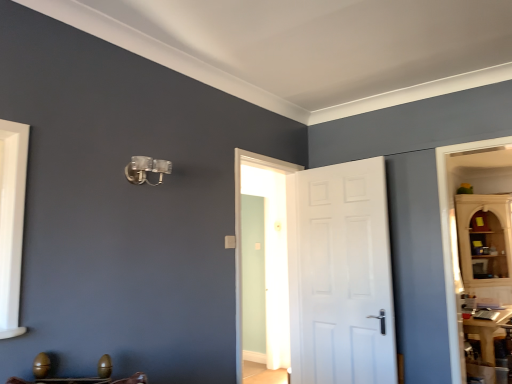
Question: From the image's perspective, is wooden egg-shaped objects at lower left above or below white matte door at center?

Choices:
 (A) below
 (B) above

Answer: (A)

Question: Is wooden egg-shaped objects at lower left in front of or behind white matte door at center in the image?

Choices:
 (A) front
 (B) behind

Answer: (A)

Question: Looking at the image, does wooden egg-shaped objects at lower left seem bigger or smaller compared to white matte door at center?

Choices:
 (A) big
 (B) small

Answer: (B)

Question: From the image's perspective, is white matte door at center positioned above or below wooden egg-shaped objects at lower left?

Choices:
 (A) above
 (B) below

Answer: (A)

Question: Does point (286, 213) appear closer or farther from the camera than point (83, 380)?

Choices:
 (A) closer
 (B) farther

Answer: (B)

Question: In terms of height, does white matte door at center look taller or shorter compared to wooden egg-shaped objects at lower left?

Choices:
 (A) tall
 (B) short

Answer: (A)

Question: Considering their positions, is white matte door at center located in front of or behind wooden egg-shaped objects at lower left?

Choices:
 (A) front
 (B) behind

Answer: (B)